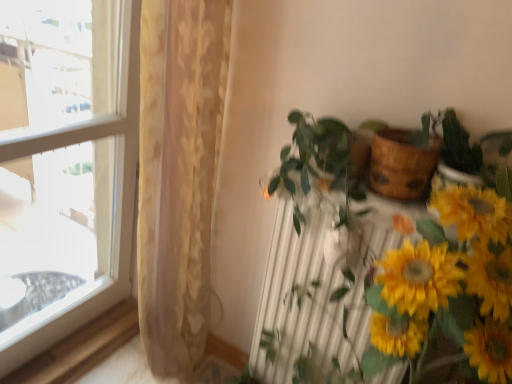
The image size is (512, 384). I want to click on green glossy plant at center, so click(x=382, y=274).

Measure the distance between white metallic radiator at center and camera.

A distance of 3.46 feet exists between white metallic radiator at center and camera.

In order to click on translucent beige curtain at left in this screenshot , I will do (178, 173).

Identify the location of transparent glass window at left. Image resolution: width=512 pixels, height=384 pixels. (67, 166).

This screenshot has height=384, width=512. What do you see at coordinates (67, 166) in the screenshot?
I see `transparent glass window at left` at bounding box center [67, 166].

You are a GUI agent. You are given a task and a screenshot of the screen. Output one action in this format:
    pyautogui.click(x=<x>, y=<y>)
    Task: Click on the yellow matte sunflowers at lower right
    This screenshot has height=384, width=512.
    Given the screenshot: What is the action you would take?
    pyautogui.click(x=449, y=288)

Find the location of `wooden at upper right`. wooden at upper right is located at coordinates (401, 164).

Locate an element on the screen. Image resolution: width=512 pixels, height=384 pixels. radiator located below the transparent glass window at left (from the image's perspective) is located at coordinates (318, 288).

Who is smaller, transparent glass window at left or white metallic radiator at center?

With smaller size is white metallic radiator at center.

Considering the sizes of transparent glass window at left and white metallic radiator at center in the image, is transparent glass window at left wider or thinner than white metallic radiator at center?

Considering their sizes, transparent glass window at left looks slimmer than white metallic radiator at center.

Which object is positioned more to the right, transparent glass window at left or white metallic radiator at center?

white metallic radiator at center is more to the right.

Would you say translucent beige curtain at left is to the left or to the right of yellow matte sunflowers at lower right in the picture?

In the image, translucent beige curtain at left appears on the left side of yellow matte sunflowers at lower right.

Is translucent beige curtain at left positioned behind yellow matte sunflowers at lower right?

Yes, it is behind yellow matte sunflowers at lower right.

From a real-world perspective, who is located higher, translucent beige curtain at left or yellow matte sunflowers at lower right?

yellow matte sunflowers at lower right, from a real-world perspective.

Does point (184, 268) come behind point (423, 224)?

Yes, point (184, 268) is farther from viewer.

Does yellow matte sunflowers at lower right have a larger size compared to translucent beige curtain at left?

No, yellow matte sunflowers at lower right is not bigger than translucent beige curtain at left.

How many degrees apart are the facing directions of yellow matte sunflowers at lower right and translucent beige curtain at left?

90 degrees.

Considering the relative sizes of yellow matte sunflowers at lower right and translucent beige curtain at left in the image provided, is yellow matte sunflowers at lower right shorter than translucent beige curtain at left?

Correct, yellow matte sunflowers at lower right is not as tall as translucent beige curtain at left.

Is transparent glass window at left not within wooden at upper right?

That's correct, transparent glass window at left is outside of wooden at upper right.

From the picture: Considering the sizes of objects transparent glass window at left and wooden at upper right in the image provided, who is bigger, transparent glass window at left or wooden at upper right?

With larger size is transparent glass window at left.

Is point (109, 138) positioned after point (413, 176)?

Yes.

In order to click on window on the left side of white metallic radiator at center in this screenshot , I will do `click(67, 166)`.

Between white metallic radiator at center and transparent glass window at left, which one has more height?

transparent glass window at left.

Would you say white metallic radiator at center is inside or outside transparent glass window at left?

white metallic radiator at center exists outside the volume of transparent glass window at left.

What's the angular difference between white metallic radiator at center and transparent glass window at left's facing directions?

89.7 degrees.

Is yellow matte sunflowers at lower right directly adjacent to white metallic radiator at center?

No, yellow matte sunflowers at lower right is not beside white metallic radiator at center.

Does point (438, 213) come in front of point (302, 265)?

Yes.

Considering the sizes of objects yellow matte sunflowers at lower right and white metallic radiator at center in the image provided, who is bigger, yellow matte sunflowers at lower right or white metallic radiator at center?

yellow matte sunflowers at lower right is bigger.

Is yellow matte sunflowers at lower right facing away from white metallic radiator at center?

yellow matte sunflowers at lower right does not have its back to white metallic radiator at center.

Can we say green glossy plant at center lies outside transparent glass window at left?

green glossy plant at center lies outside transparent glass window at left's area.

Which is more distant, [306,210] or [11,34]?

The point [11,34] is behind.

Image resolution: width=512 pixels, height=384 pixels. Identify the location of houseplant behind the transparent glass window at left. (382, 274).

You are a GUI agent. You are given a task and a screenshot of the screen. Output one action in this format:
    pyautogui.click(x=<x>, y=<y>)
    Task: Click on the radiator lying on the right of transparent glass window at left
    This screenshot has width=512, height=384.
    Given the screenshot: What is the action you would take?
    pyautogui.click(x=318, y=288)

The image size is (512, 384). What are the coordinates of `floral arrangement below the translucent beige curtain at left (from the image's perspective)` in the screenshot? It's located at pyautogui.click(x=449, y=288).

When comparing their distances from wooden at upper right, does translucent beige curtain at left or white metallic radiator at center seem further?

The object further to wooden at upper right is translucent beige curtain at left.

Based on their spatial positions, is wooden at upper right or yellow matte sunflowers at lower right closer to white metallic radiator at center?

yellow matte sunflowers at lower right is positioned closer to the anchor white metallic radiator at center.

From the image, which object appears to be farther from green glossy plant at center, white metallic radiator at center or transparent glass window at left?

Based on the image, transparent glass window at left appears to be further to green glossy plant at center.

Considering their positions, is translucent beige curtain at left positioned further to white metallic radiator at center than transparent glass window at left?

The object further to white metallic radiator at center is transparent glass window at left.

From the image, which object appears to be farther from white metallic radiator at center, yellow matte sunflowers at lower right or transparent glass window at left?

transparent glass window at left lies further to white metallic radiator at center than the other object.

Based on their spatial positions, is yellow matte sunflowers at lower right or green glossy plant at center further from translucent beige curtain at left?

The object further to translucent beige curtain at left is yellow matte sunflowers at lower right.

Which object lies nearer to the anchor point yellow matte sunflowers at lower right, translucent beige curtain at left or transparent glass window at left?

translucent beige curtain at left lies closer to yellow matte sunflowers at lower right than the other object.

Looking at the image, which one is located further to yellow matte sunflowers at lower right, white metallic radiator at center or transparent glass window at left?

transparent glass window at left.

Find the location of a particular element. The image size is (512, 384). flowerpot between translucent beige curtain at left and yellow matte sunflowers at lower right from left to right is located at coordinates (401, 164).

Find the location of a particular element. radiator between transparent glass window at left and green glossy plant at center is located at coordinates (318, 288).

Locate an element on the screen. Image resolution: width=512 pixels, height=384 pixels. floral arrangement between wooden at upper right and white metallic radiator at center from top to bottom is located at coordinates (449, 288).

Locate an element on the screen. The image size is (512, 384). flowerpot located between transparent glass window at left and yellow matte sunflowers at lower right in the left-right direction is located at coordinates coord(401,164).